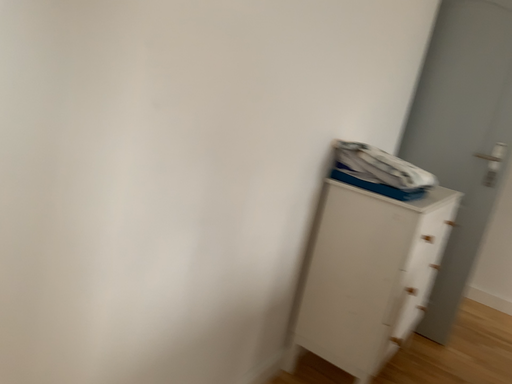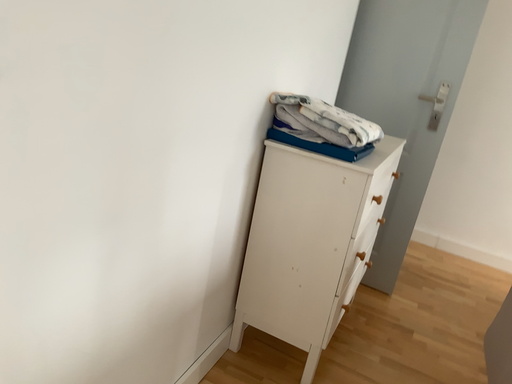
Question: How did the camera likely rotate when shooting the video?

Choices:
 (A) rotated right
 (B) rotated left

Answer: (A)